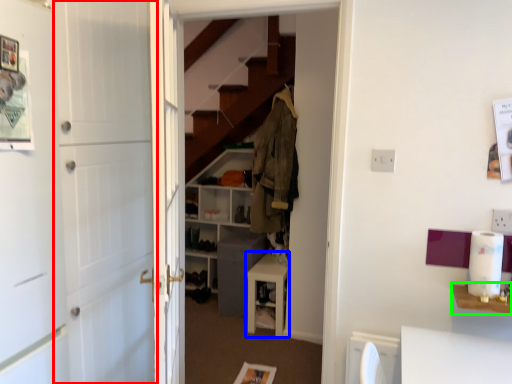
Question: Based on their relative distances, which object is nearer to barn door (highlighted by a red box)? Choose from furniture (highlighted by a blue box) and table (highlighted by a green box).

Choices:
 (A) furniture
 (B) table

Answer: (A)